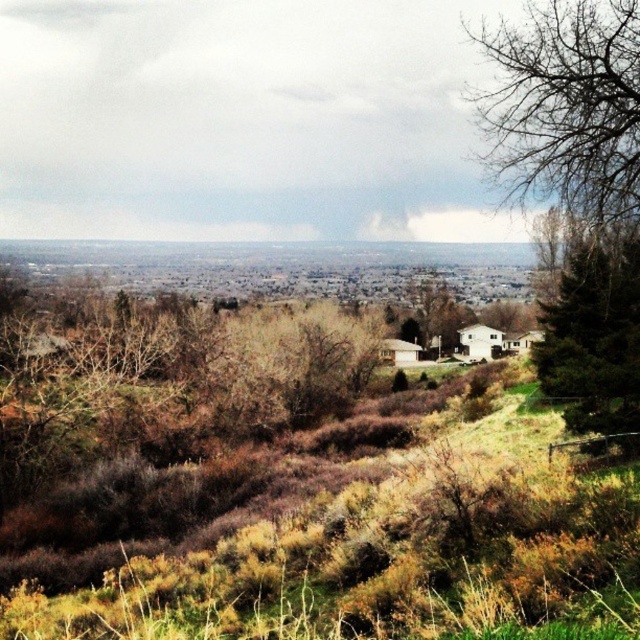
You are standing in the rural landscape and want to walk from the point closer to you to the farther point. Which path would you take between the two points, point (420, 554) and point (576, 316)?

The path from point (420, 554) to point (576, 316) is the correct route since point (420, 554) is closer to the viewer and the other is farther away.

You are a hiker who wants to set up a tent in the area shown. Considering the brown dry grass at lower center and the green textured pine tree at right, which location would provide more space for your tent?

The green textured pine tree at right occupies more space than the brown dry grass at lower center, so setting up the tent near the green textured pine tree at right would provide more space.

You are a hiker standing in the middle of the scene and see the brown dry grass at lower center and the green textured pine tree at right. Which object is closer to your left side?

The brown dry grass at lower center is to the left of the green textured pine tree at right, so it is closer to your left side.